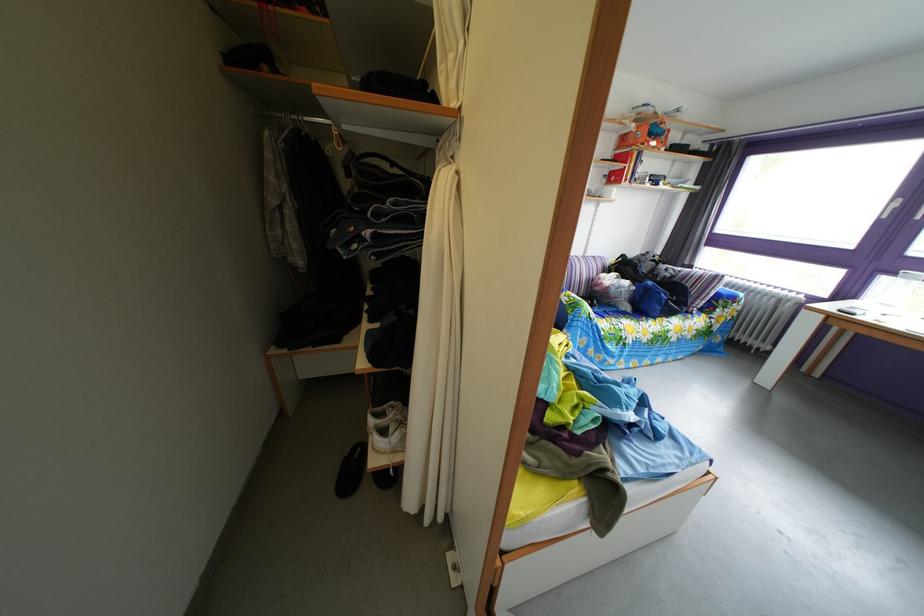
Where is `white curtain`? Image resolution: width=924 pixels, height=616 pixels. white curtain is located at coordinates (439, 294).